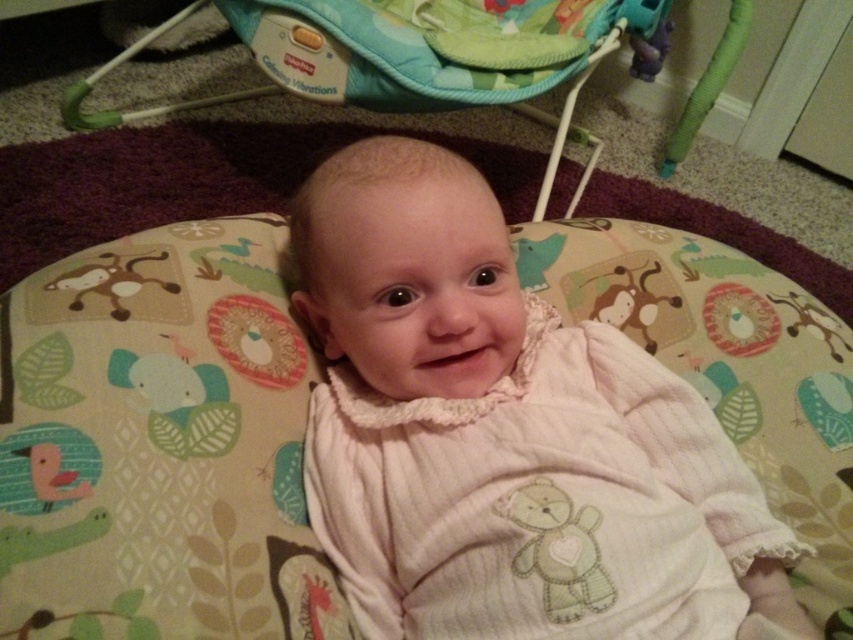
You are a parent trying to ensure the baby is safe. The white soft fabric baby at center is lying on a play mat. Is the green plastic baby swing at upper center hanging above the baby?

Yes, the white soft fabric baby at center is positioned under the green plastic baby swing at upper center, so the swing is hanging above the baby.

You are a photographer setting up for a baby photoshoot. The baby is lying on a play mat, and you want to capture a closeup shot of the baby while ensuring the background is slightly blurred. Given that the white soft fabric baby at center is 53.60 centimeters from viewer, what is the minimum distance you should set your camera lens to focus on to ensure the baby is in sharp focus?

The white soft fabric baby at center is 53.60 centimeters from the viewer. To ensure the baby is in sharp focus for the closeup shot, the camera lens should be focused at a minimum distance of 53.60 centimeters.

You are a parent holding a baby toy and want to place it exactly at point [263,61]. If you are currently standing 1.37 meters away from that point, can you reach it without moving your feet?

The point [263,61] is 1.37 meters away from you. Since the average human arm span is about 1.3 meters, you might not be able to reach it without moving your feet.